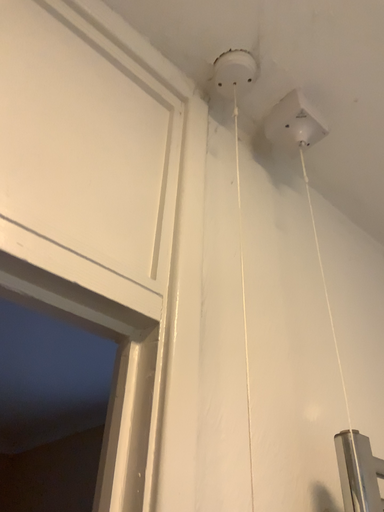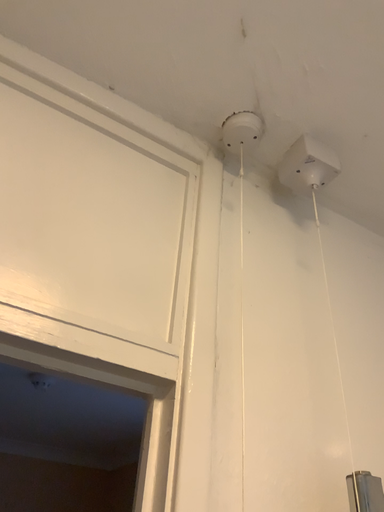
Question: How did the camera likely rotate when shooting the video?

Choices:
 (A) rotated right
 (B) rotated left

Answer: (B)